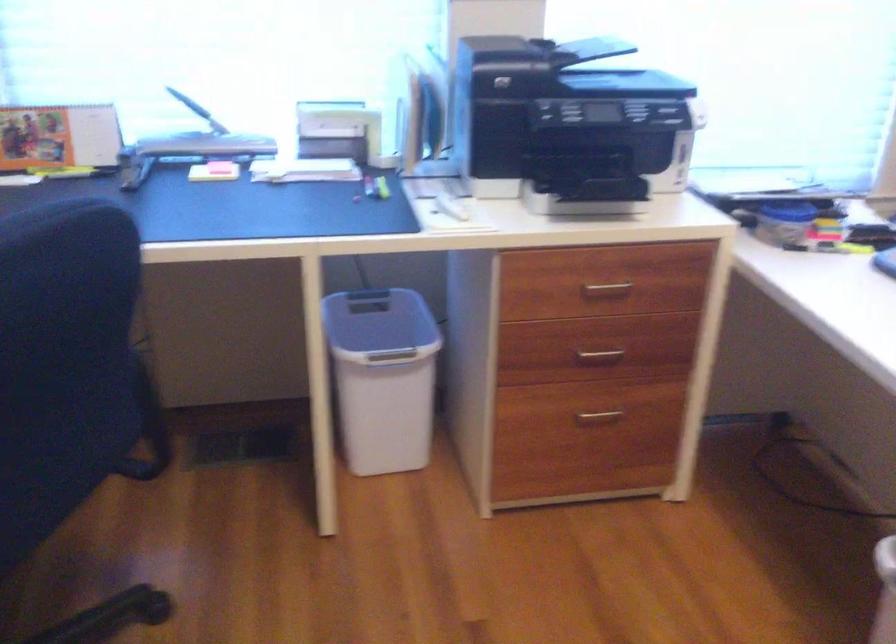
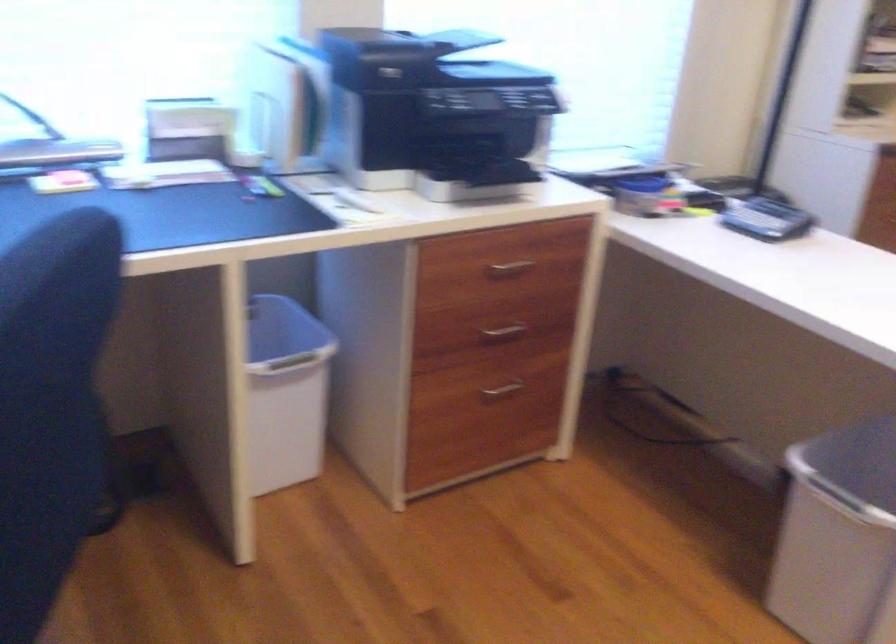
Question: How did the camera likely rotate?

Choices:
 (A) Left
 (B) Right
 (C) Up
 (D) Down

Answer: (B)